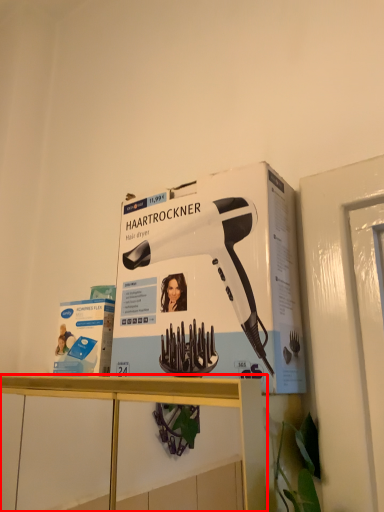
Question: From the image's perspective, what is the correct spatial positioning of furniture (annotated by the red box) in reference to hair drier?

Choices:
 (A) above
 (B) below

Answer: (B)